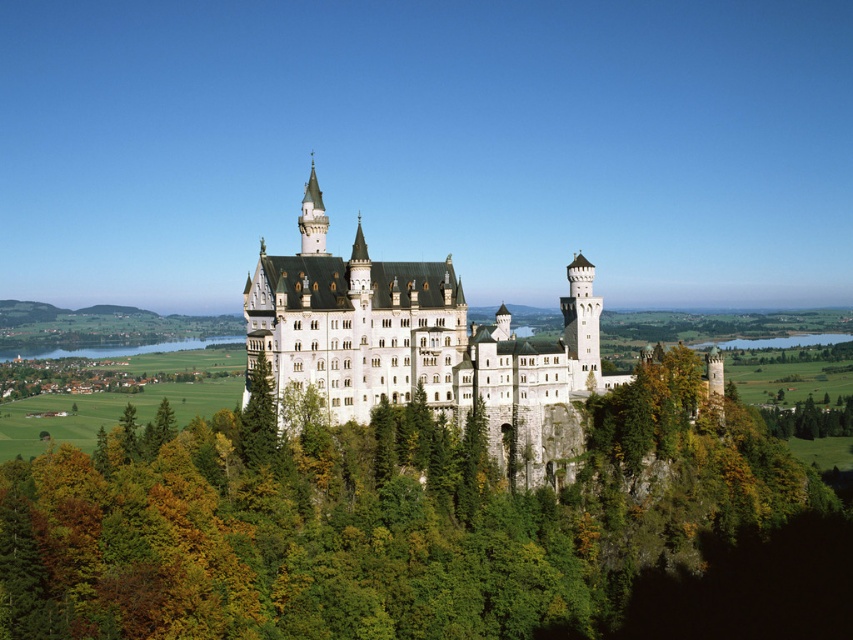
Question: Which object is closer to the camera taking this photo?

Choices:
 (A) green leafy tree at center
 (B) white stone castle at center

Answer: (A)

Question: Can you confirm if green leafy tree at center is wider than white stone castle at center?

Choices:
 (A) no
 (B) yes

Answer: (B)

Question: Is green leafy tree at center below white stone castle at center?

Choices:
 (A) yes
 (B) no

Answer: (A)

Question: Is the position of green leafy tree at center less distant than that of white stone castle at center?

Choices:
 (A) no
 (B) yes

Answer: (B)

Question: Among these objects, which one is nearest to the camera?

Choices:
 (A) green leafy tree at center
 (B) white stone castle at center

Answer: (A)

Question: Which of the following is the farthest from the observer?

Choices:
 (A) white stone castle at center
 (B) green leafy tree at center

Answer: (A)